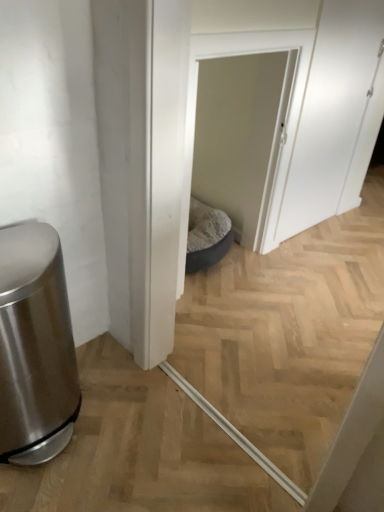
You are a GUI agent. You are given a task and a screenshot of the screen. Output one action in this format:
    pyautogui.click(x=<x>, y=<y>)
    Task: Click on the vacant space in white fabric pet bed at center, the second screen door when ordered from right to left (from a real-world perspective)
    This screenshot has height=512, width=384.
    Given the screenshot: What is the action you would take?
    pyautogui.click(x=227, y=273)